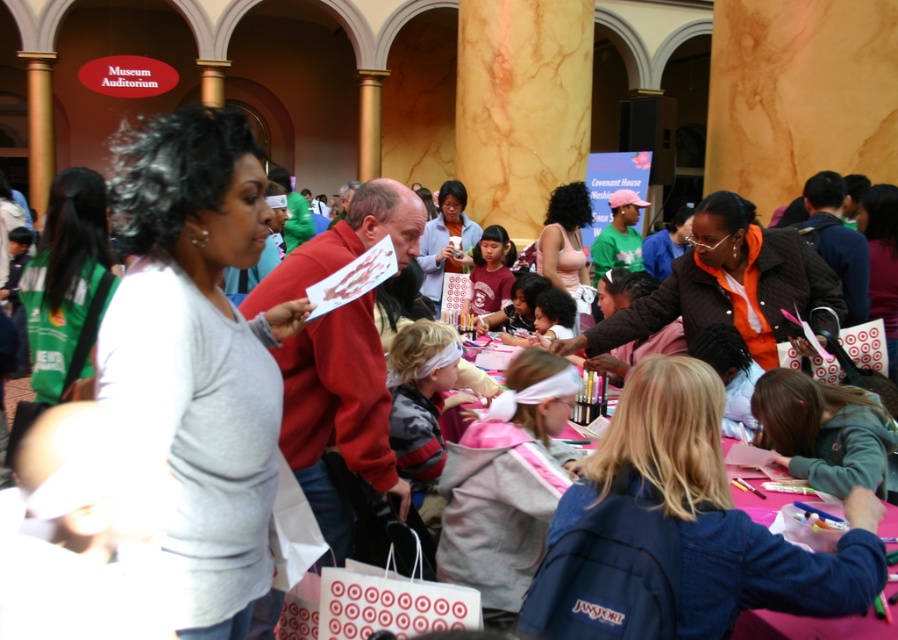
Can you confirm if green fabric bag at left is positioned below pink matte tank top at center?

Correct, green fabric bag at left is located below pink matte tank top at center.

Can you confirm if green fabric bag at left is positioned above pink matte tank top at center?

Actually, green fabric bag at left is below pink matte tank top at center.

At what (x,y) coordinates should I click in order to perform the action: click on green fabric bag at left. Please return your answer as a coordinate pair (x, y). Image resolution: width=898 pixels, height=640 pixels. Looking at the image, I should click on (64, 276).

Image resolution: width=898 pixels, height=640 pixels. In order to click on green fabric bag at left in this screenshot , I will do `click(64, 276)`.

Is gray matte sweater at center shorter than striped fleece jacket at center?

Incorrect, gray matte sweater at center's height does not fall short of striped fleece jacket at center's.

Locate an element on the screen. gray matte sweater at center is located at coordinates (199, 353).

Who is positioned more to the right, denim jacket at lower right or matte white shirt at center?

denim jacket at lower right is more to the right.

Is denim jacket at lower right closer to camera compared to matte white shirt at center?

That is True.

Image resolution: width=898 pixels, height=640 pixels. Find the location of `denim jacket at lower right`. denim jacket at lower right is located at coordinates (681, 531).

Where is `denim jacket at lower right`? This screenshot has height=640, width=898. denim jacket at lower right is located at coordinates (681, 531).